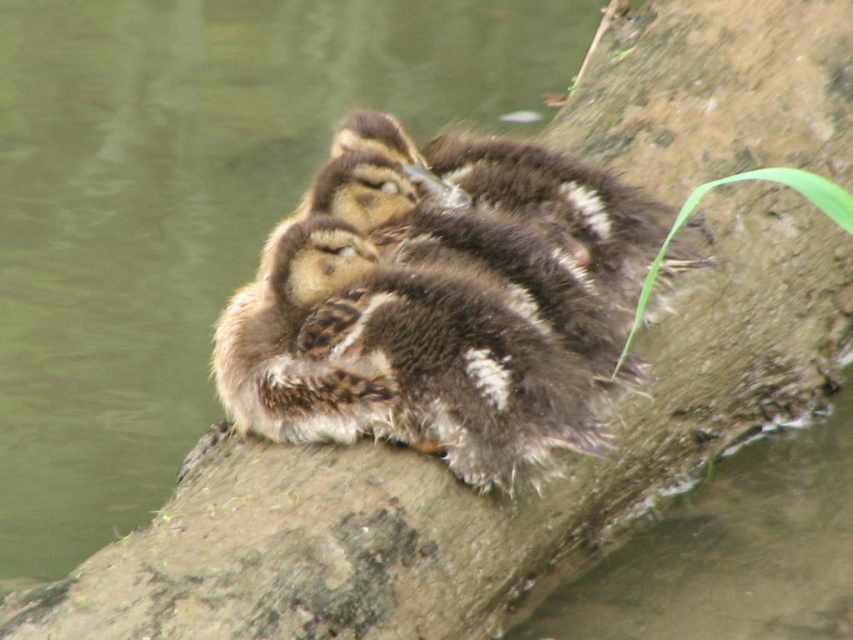
You are a wildlife photographer aiming to capture a closeup shot of the ducklings. Given that your camera lens has a maximum width coverage of 30 cm, can you fit both the brown fuzzy ducklings at center and the brown fluffy ducklings at center into the frame without moving the camera?

The brown fuzzy ducklings at center might be wider than brown fluffy ducklings at center, so the total width of both ducklings could exceed the camera lens coverage of 30 cm. It depends on their exact combined width.

You are standing near the edge of the water and want to reach the point marked as point (207, 28) where the ducklings are resting. If you can walk 3 meters in 1 minute, how long will it take you to reach the point?

The point (207, 28) is 5.93 meters away from the viewer. Since you can walk 3 meters in 1 minute, it will take approximately 2 minutes to reach the point because 5.93 divided by 3 is approximately 1.98, which rounds up to 2 minutes.